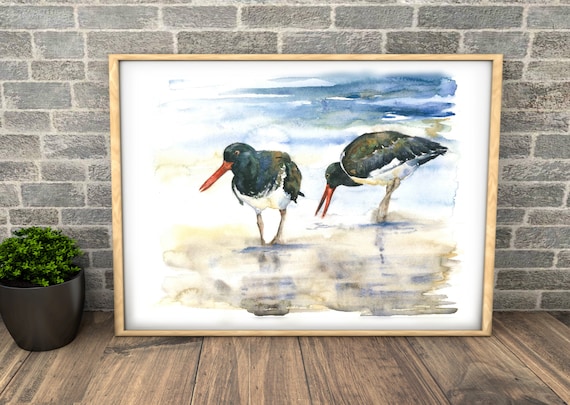
In order to click on wall in this screenshot , I will do `click(518, 114)`.